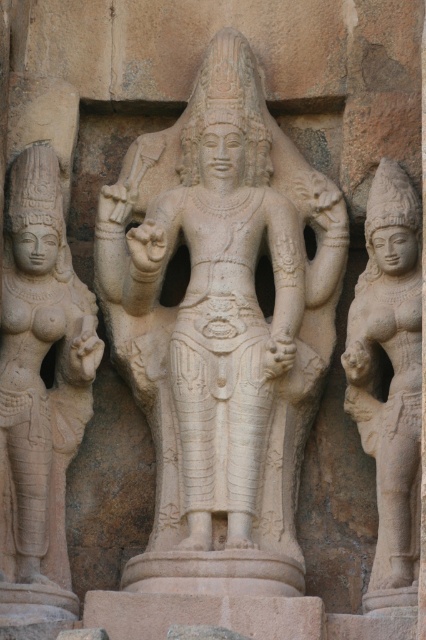
What are the coordinates of `white stone statue at center` in the screenshot? It's located at (222, 308).

The image size is (426, 640). I want to click on white stone statue at center, so click(x=222, y=308).

The image size is (426, 640). I want to click on white stone statue at center, so click(222, 308).

Is white stone statue at center to the right of beige stone statue at right from the viewer's perspective?

Incorrect, white stone statue at center is not on the right side of beige stone statue at right.

How much distance is there between white stone statue at center and beige stone statue at right?

A distance of 17.40 feet exists between white stone statue at center and beige stone statue at right.

Does point (169, 387) come in front of point (420, 385)?

No, (169, 387) is further to viewer.

Where is `white stone statue at center`? white stone statue at center is located at coordinates (222, 308).

Which is in front, point (26, 456) or point (376, 372)?

Point (26, 456) is in front.

Describe the element at coordinates (40, 372) in the screenshot. The image size is (426, 640). I see `beige stone statue at left` at that location.

This screenshot has width=426, height=640. Find the location of `beige stone statue at left`. beige stone statue at left is located at coordinates (40, 372).